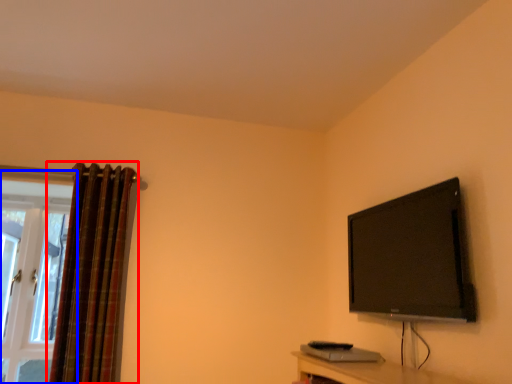
Question: Among these objects, which one is nearest to the camera, curtain (highlighted by a red box) or window (highlighted by a blue box)?

Choices:
 (A) curtain
 (B) window

Answer: (A)